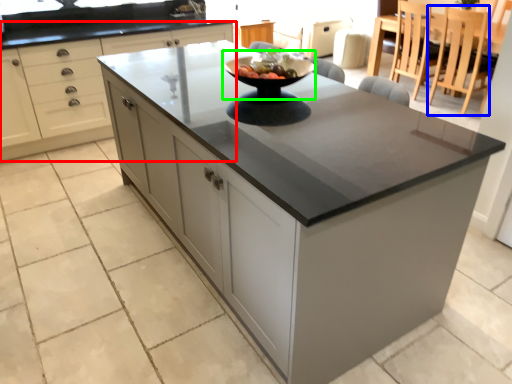
Question: Which is nearer to the cabinetry (highlighted by a red box)? chair (highlighted by a blue box) or mixing bowl (highlighted by a green box).

Choices:
 (A) chair
 (B) mixing bowl

Answer: (B)